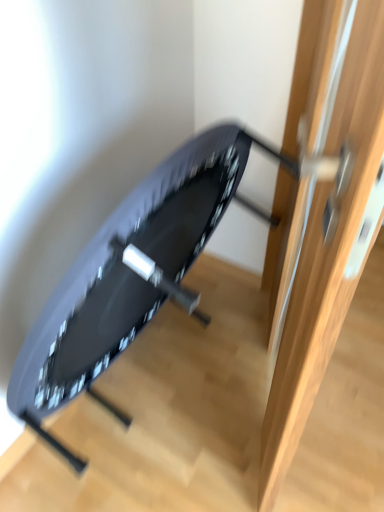
Where is `vacant space underneath wooden door at center (from a real-world perspective)`? vacant space underneath wooden door at center (from a real-world perspective) is located at coordinates (257, 382).